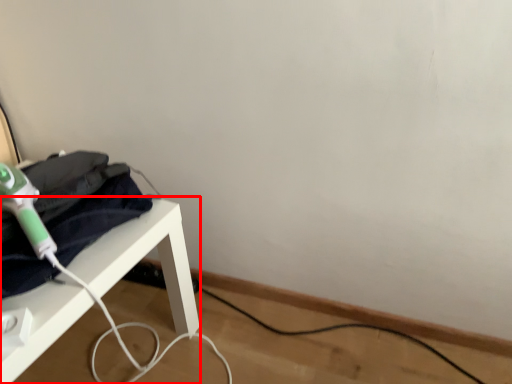
Question: From the image's perspective, considering the relative positions of furniture (annotated by the red box) and hair drier in the image provided, where is furniture (annotated by the red box) located with respect to the staircase?

Choices:
 (A) above
 (B) below

Answer: (B)